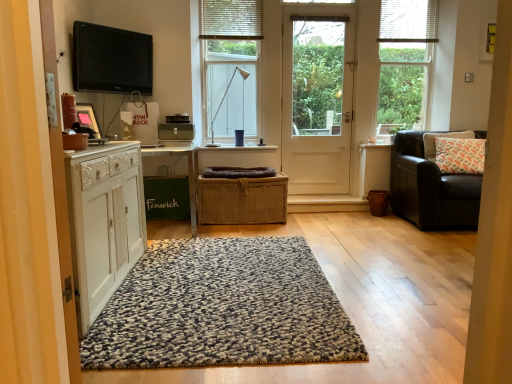
Question: From the image's perspective, would you say green fabric bag at left is shown under white textured blind at upper center, which is counted as the 2th blind, starting from the right?

Choices:
 (A) no
 (B) yes

Answer: (B)

Question: Can you confirm if green fabric bag at left is smaller than white textured blind at upper center, the 1th blind viewed from the left?

Choices:
 (A) no
 (B) yes

Answer: (A)

Question: From the image's perspective, does green fabric bag at left appear higher than white textured blind at upper center, the 1th blind viewed from the left?

Choices:
 (A) yes
 (B) no

Answer: (B)

Question: Can white textured blind at upper center, the 1th blind viewed from the left, be found inside green fabric bag at left?

Choices:
 (A) yes
 (B) no

Answer: (B)

Question: Could you tell me if green fabric bag at left is turned towards white textured blind at upper center, the 1th blind viewed from the left?

Choices:
 (A) yes
 (B) no

Answer: (B)

Question: Does green fabric bag at left have a greater width compared to white textured blind at upper center, which is counted as the 2th blind, starting from the right?

Choices:
 (A) no
 (B) yes

Answer: (B)

Question: Is white fabric pillow at right facing towards green fabric bag at left?

Choices:
 (A) no
 (B) yes

Answer: (A)

Question: Can you confirm if white fabric pillow at right is shorter than green fabric bag at left?

Choices:
 (A) no
 (B) yes

Answer: (B)

Question: Can you confirm if white fabric pillow at right is wider than green fabric bag at left?

Choices:
 (A) no
 (B) yes

Answer: (A)

Question: Is white fabric pillow at right further to camera compared to green fabric bag at left?

Choices:
 (A) no
 (B) yes

Answer: (B)

Question: From the image's perspective, does white fabric pillow at right appear lower than green fabric bag at left?

Choices:
 (A) no
 (B) yes

Answer: (A)

Question: Is white fabric pillow at right taller than green fabric bag at left?

Choices:
 (A) no
 (B) yes

Answer: (A)

Question: Considering the relative positions of leather couch at right and green fabric bag at left in the image provided, is leather couch at right to the left of green fabric bag at left from the viewer's perspective?

Choices:
 (A) no
 (B) yes

Answer: (A)